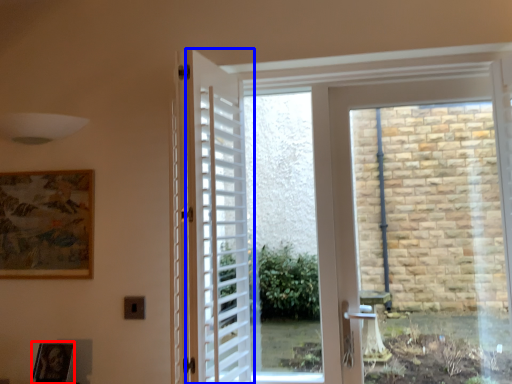
Question: Which object is closer to the camera taking this photo, picture frame (highlighted by a red box) or door (highlighted by a blue box)?

Choices:
 (A) picture frame
 (B) door

Answer: (B)